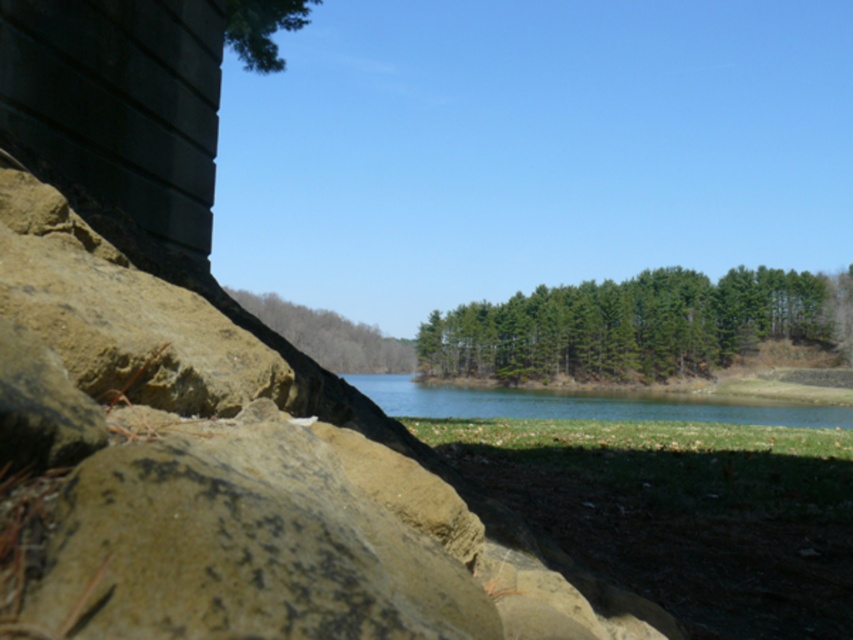
You are standing at the rocky foreground and looking towards the green leafy trees at center and the green leafy tree at center. Which one appears nearer to you?

The green leafy trees at center appears nearer to the viewer than the green leafy tree at center.

You are an outdoor photographer planning to capture the green leafy tree at center and the green textured tree at upper left in the same frame. Based on their sizes in the image, which tree would appear larger in your photo?

The green leafy tree at center appears larger in the photo because it is much taller than the green textured tree at upper left.